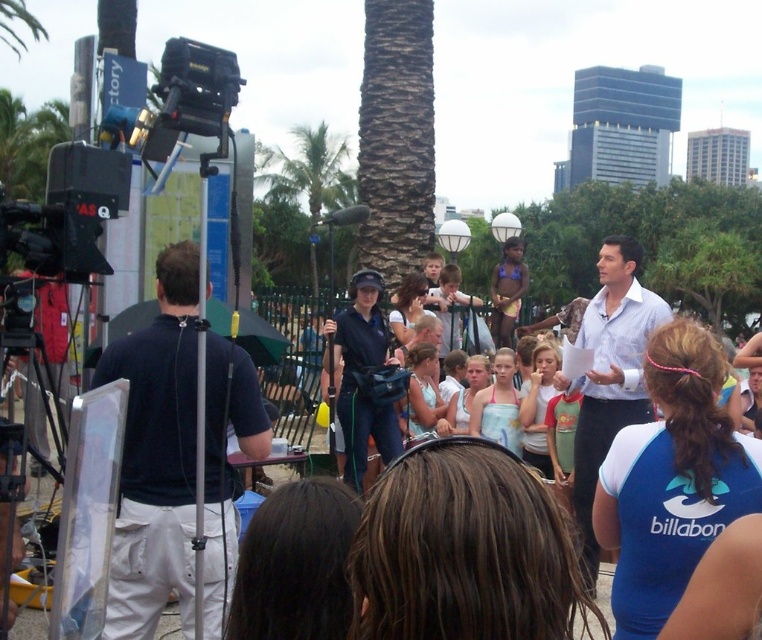
You are standing at the back of the crowd in the park scene. Which object, the dark blue shirt at left or the green leafy palm tree at center, would block your view of the other?

The dark blue shirt at left is in front of the green leafy palm tree at center, so the dark blue shirt at left would block your view of the green leafy palm tree at center.

You are standing at the center of the image and want to locate the dark blue shirt at left. In which direction should you look to find it?

You should look to the left to find the dark blue shirt at left as it is located at point (155, 456) which is on the left side of the image.

In the scene shown: You are a photographer at the event and need to capture a photo that includes both the dark blue shirt at left and the white textured shirt at center. Which person should you focus on first to ensure both are in frame?

The dark blue shirt at left is shorter than the white textured shirt at center, so you should focus on the white textured shirt at center first to ensure both are in frame.